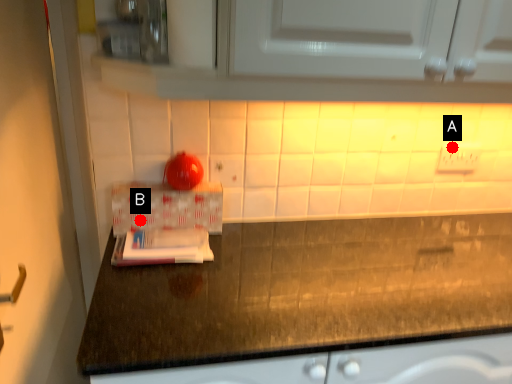
Question: Two points are circled on the image, labeled by A and B beside each circle. Which point appears closest to the camera in this image?

Choices:
 (A) A is closer
 (B) B is closer

Answer: (B)